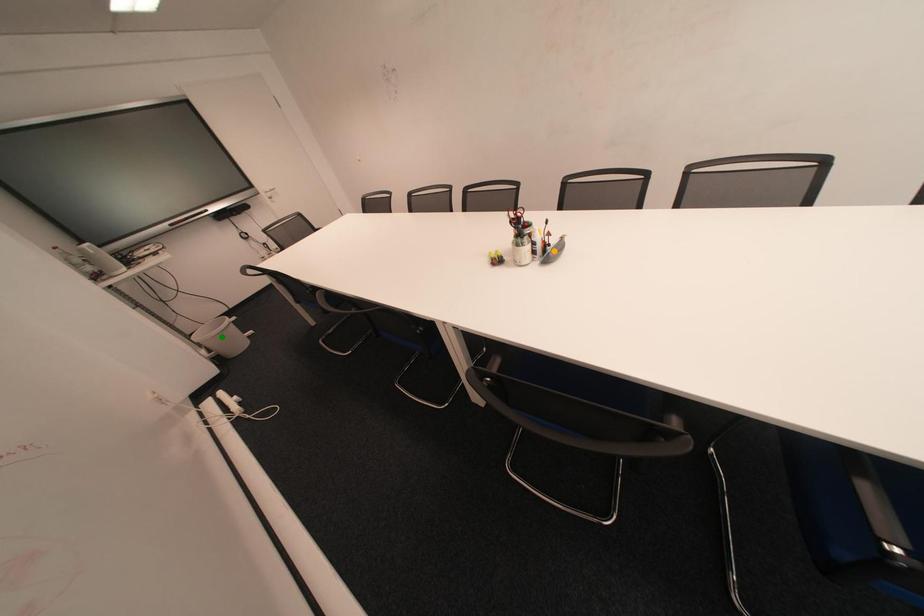
Order these from nearest to farthest:
red point
orange point
green point

1. orange point
2. red point
3. green point